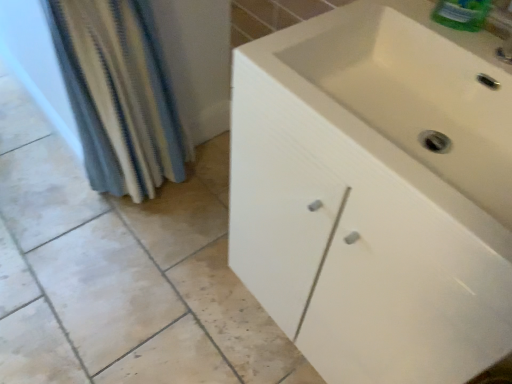
Image resolution: width=512 pixels, height=384 pixels. I want to click on free spot in front of blue striped fabric at left, so click(125, 258).